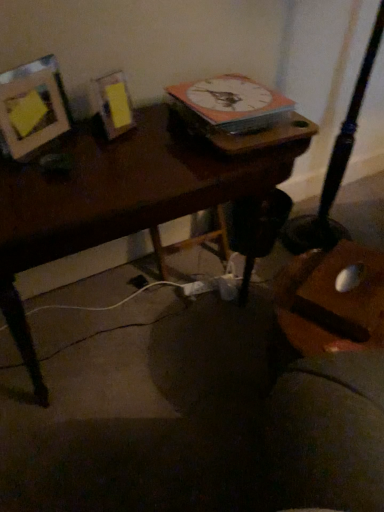
Question: Is matte wood picture frame at upper left looking in the opposite direction of white glossy clock at upper center?

Choices:
 (A) yes
 (B) no

Answer: (B)

Question: Is the depth of matte wood picture frame at upper left greater than that of white glossy clock at upper center?

Choices:
 (A) yes
 (B) no

Answer: (B)

Question: Can you confirm if matte wood picture frame at upper left is bigger than white glossy clock at upper center?

Choices:
 (A) no
 (B) yes

Answer: (A)

Question: Considering the relative sizes of matte wood picture frame at upper left and white glossy clock at upper center in the image provided, is matte wood picture frame at upper left wider than white glossy clock at upper center?

Choices:
 (A) no
 (B) yes

Answer: (A)

Question: Does matte wood picture frame at upper left turn towards white glossy clock at upper center?

Choices:
 (A) no
 (B) yes

Answer: (A)

Question: Is matte wood picture frame at upper left next to white glossy clock at upper center and touching it?

Choices:
 (A) no
 (B) yes

Answer: (A)

Question: Considering the relative sizes of wooden desk at center and matte wood picture frame at upper left in the image provided, is wooden desk at center smaller than matte wood picture frame at upper left?

Choices:
 (A) no
 (B) yes

Answer: (A)

Question: Does wooden desk at center lie in front of matte wood picture frame at upper left?

Choices:
 (A) yes
 (B) no

Answer: (A)

Question: From a real-world perspective, is wooden desk at center positioned over matte wood picture frame at upper left based on gravity?

Choices:
 (A) yes
 (B) no

Answer: (B)

Question: From the image's perspective, is wooden desk at center below matte wood picture frame at upper left?

Choices:
 (A) yes
 (B) no

Answer: (A)

Question: Can we say wooden desk at center lies outside matte wood picture frame at upper left?

Choices:
 (A) no
 (B) yes

Answer: (B)

Question: Considering the relative sizes of wooden desk at center and matte wood picture frame at upper left in the image provided, is wooden desk at center taller than matte wood picture frame at upper left?

Choices:
 (A) no
 (B) yes

Answer: (B)

Question: Is matte wood picture frame at upper left not close to wooden desk at center?

Choices:
 (A) yes
 (B) no

Answer: (B)